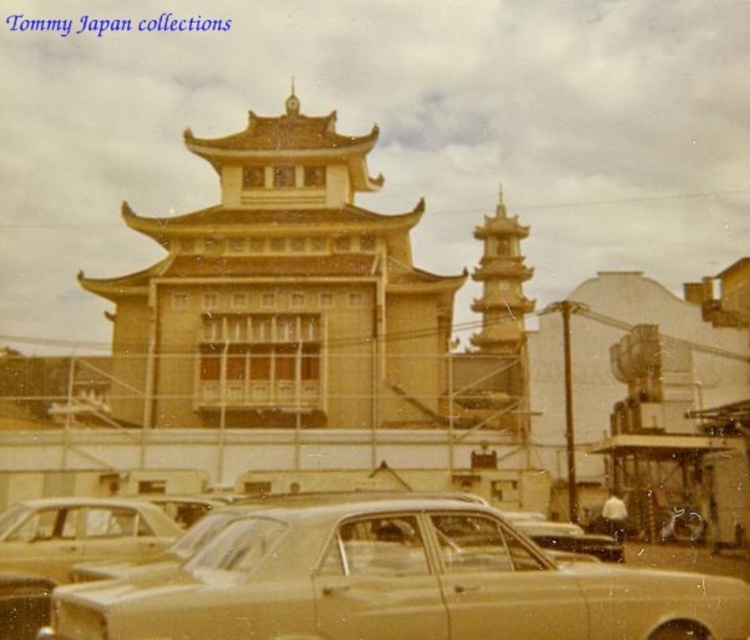
Question: Is yellow matte temple at center wider than gold metallic car at lower left?

Choices:
 (A) no
 (B) yes

Answer: (B)

Question: Considering the real-world distances, which object is farthest from the gold metallic car at lower left?

Choices:
 (A) yellow matte temple at center
 (B) gold metallic car at lower center

Answer: (A)

Question: Among these objects, which one is farthest from the camera?

Choices:
 (A) yellow matte temple at center
 (B) gold metallic car at lower center

Answer: (A)

Question: Is yellow matte temple at center positioned at the back of gold metallic car at lower left?

Choices:
 (A) yes
 (B) no

Answer: (A)

Question: In this image, where is gold metallic car at lower center located relative to gold metallic car at lower left?

Choices:
 (A) left
 (B) right

Answer: (B)

Question: Based on their relative distances, which object is nearer to the yellow matte temple at center?

Choices:
 (A) gold metallic car at lower left
 (B) gold metallic car at lower center

Answer: (A)